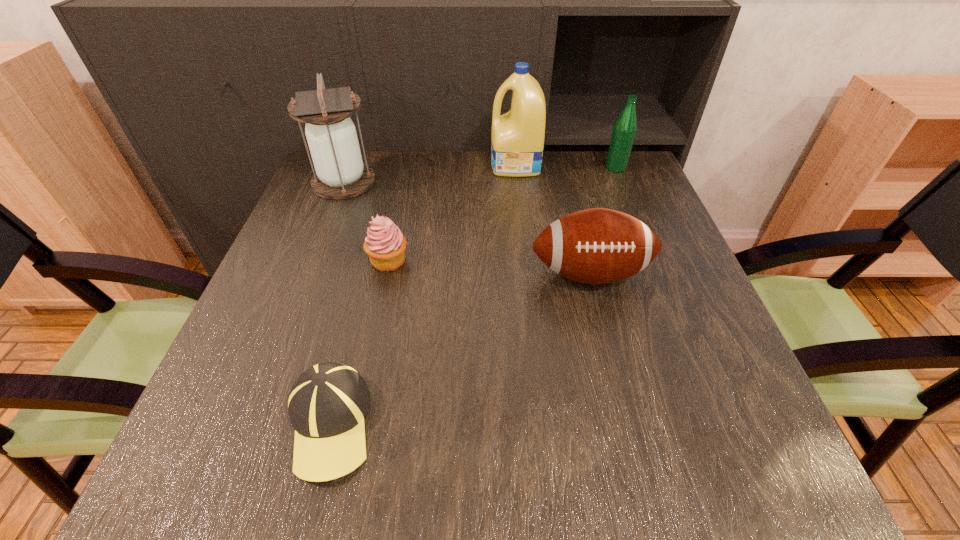
Where is `vacant space located on the right of the lantern`? The height and width of the screenshot is (540, 960). vacant space located on the right of the lantern is located at coordinates (428, 182).

Locate an element on the screen. The image size is (960, 540). free space located on the left of the bottle is located at coordinates (461, 167).

Where is `free location located 0.170m on the laces of the football`? Image resolution: width=960 pixels, height=540 pixels. free location located 0.170m on the laces of the football is located at coordinates (615, 375).

At what (x,y) coordinates should I click in order to perform the action: click on blank space located 0.270m on the front of the fifth tallest object. Please return your answer as a coordinate pair (x, y). Image resolution: width=960 pixels, height=540 pixels. Looking at the image, I should click on (361, 389).

Locate an element on the screen. detergent that is at the far edge is located at coordinates (517, 142).

You are a GUI agent. You are given a task and a screenshot of the screen. Output one action in this format:
    pyautogui.click(x=<x>, y=<y>)
    Task: Click on the lantern situated at the far edge
    The height and width of the screenshot is (540, 960).
    Given the screenshot: What is the action you would take?
    pyautogui.click(x=340, y=173)

Where is `bottle that is at the far edge`? The height and width of the screenshot is (540, 960). bottle that is at the far edge is located at coordinates (625, 127).

Where is `object present at the near edge`? The image size is (960, 540). object present at the near edge is located at coordinates (327, 404).

Identify the location of lantern that is at the left edge. (340, 173).

The height and width of the screenshot is (540, 960). Find the location of `baseball cap present at the left edge`. baseball cap present at the left edge is located at coordinates (327, 404).